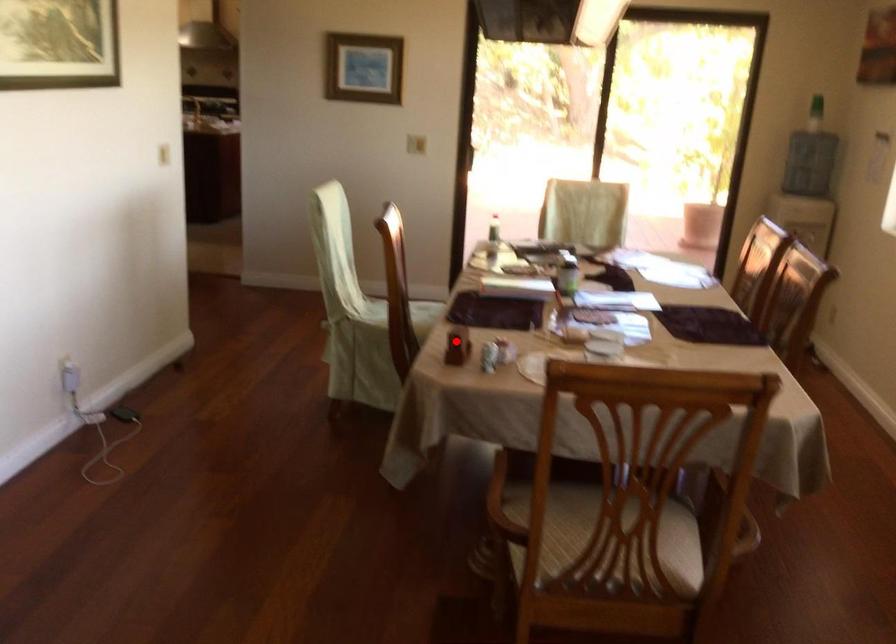
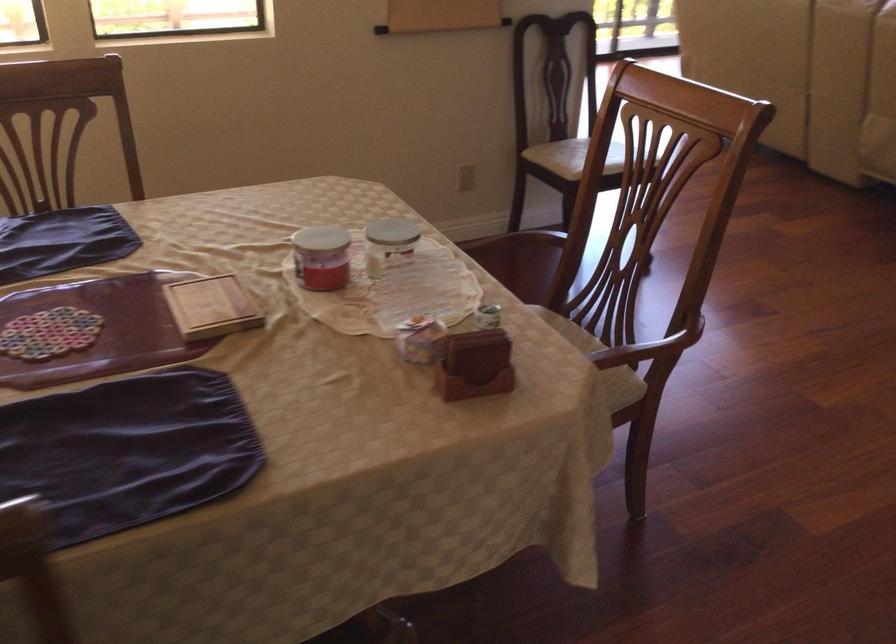
Question: I am providing you with two images of the same scene from different viewpoints. Given a red point in image1, look at the same physical point in image2. Is it:

Choices:
 (A) Closer to the viewpoint
 (B) Farther from the viewpoint

Answer: (A)